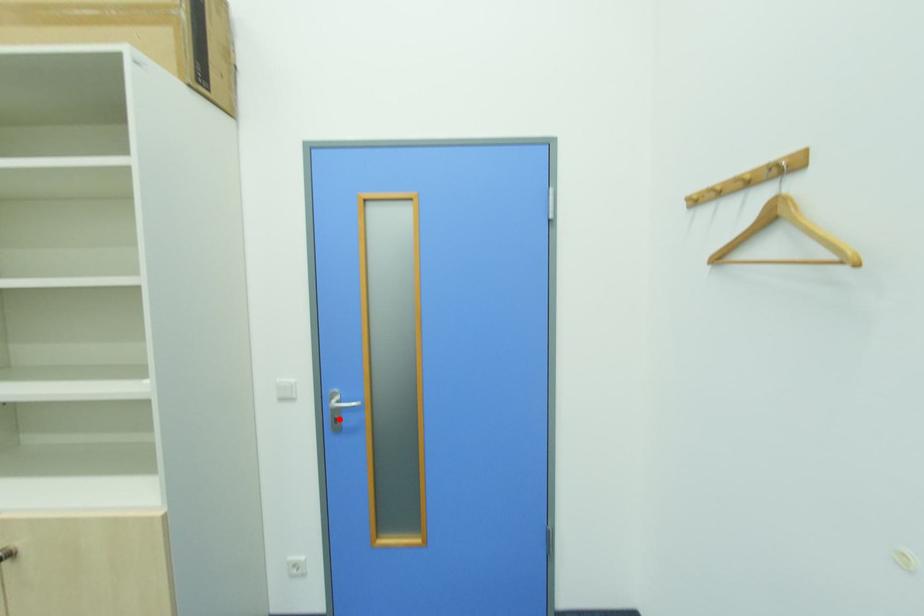
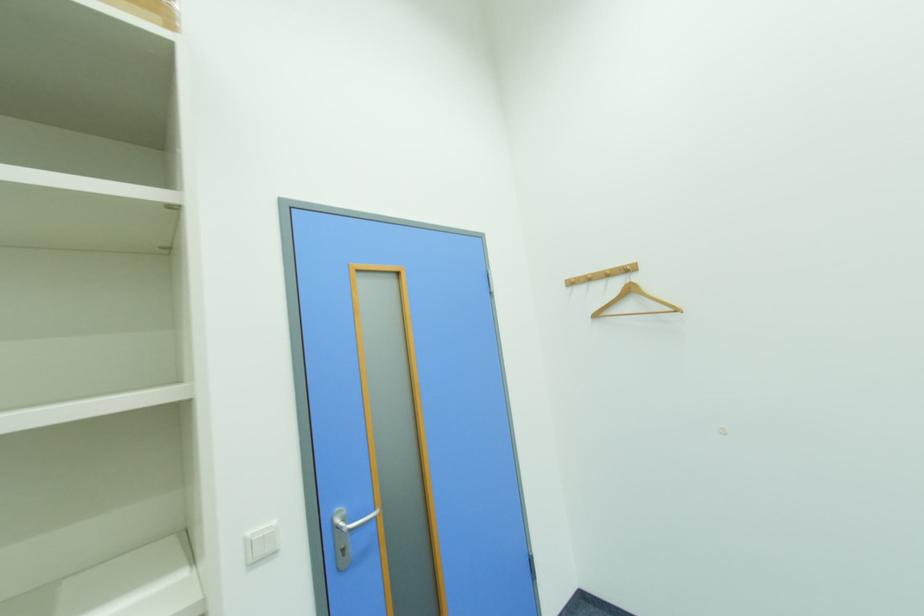
In the second image, find the point that corresponds to the highlighted location in the first image.

(347, 551)